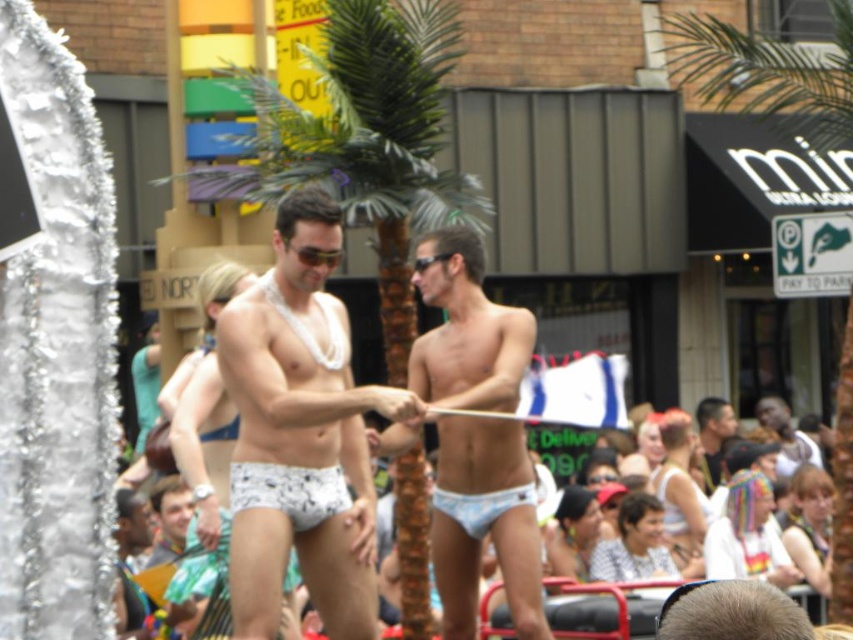
Question: Which point is farther to the camera?

Choices:
 (A) light blue fabric shorts at center
 (B) white printed underwear at center

Answer: (A)

Question: Estimate the real-world distances between objects in this image. Which object is closer to the light blue fabric shorts at center?

Choices:
 (A) white printed underwear at center
 (B) white glossy underwear at center
 (C) green leafy palm tree at center
 (D) smooth skin head at center

Answer: (D)

Question: Is white glossy underwear at center smaller than white printed fabric underwear at center?

Choices:
 (A) no
 (B) yes

Answer: (B)

Question: Is white printed underwear at center positioned before light blue fabric shorts at center?

Choices:
 (A) no
 (B) yes

Answer: (B)

Question: Which of the following is the farthest from the observer?

Choices:
 (A) (387, 397)
 (B) (239, 490)

Answer: (A)

Question: Does white glossy underwear at center have a smaller size compared to white printed fabric underwear at center?

Choices:
 (A) no
 (B) yes

Answer: (B)